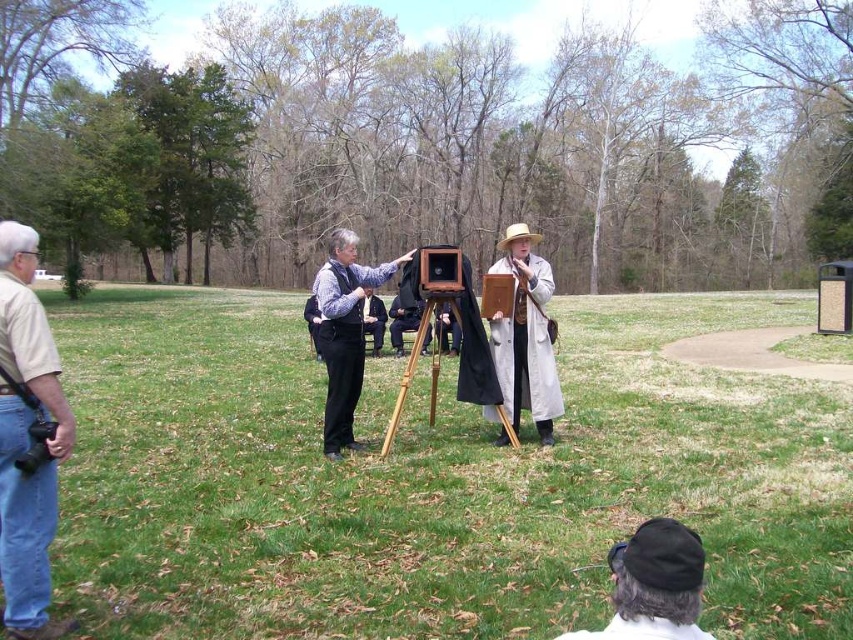
Which is behind, point (9, 460) or point (492, 317)?

The point (492, 317) is behind.

Does matte black camera at left appear on the right side of light beige fabric coat at center?

Incorrect, matte black camera at left is not on the right side of light beige fabric coat at center.

Is point (24, 604) positioned before point (521, 268)?

Yes, point (24, 604) is closer to viewer.

Locate an element on the screen. The image size is (853, 640). matte black camera at left is located at coordinates click(27, 440).

Is the position of matte wooden tripod at center less distant than that of wooden tripod at center?

Yes, it is in front of wooden tripod at center.

Can you confirm if matte wooden tripod at center is wider than wooden tripod at center?

Yes.

Is point (412, 636) behind point (430, 301)?

That is False.

You are a GUI agent. You are given a task and a screenshot of the screen. Output one action in this format:
    pyautogui.click(x=<x>, y=<y>)
    Task: Click on the matte wooden tripod at center
    
    Given the screenshot: What is the action you would take?
    pyautogui.click(x=433, y=480)

In the scene shown: Is matte black camera at left bigger than dark gray wool hat at lower center?

Yes.

Who is taller, matte black camera at left or dark gray wool hat at lower center?

Standing taller between the two is matte black camera at left.

You are a GUI agent. You are given a task and a screenshot of the screen. Output one action in this format:
    pyautogui.click(x=<x>, y=<y>)
    Task: Click on the matte black camera at left
    
    Given the screenshot: What is the action you would take?
    pyautogui.click(x=27, y=440)